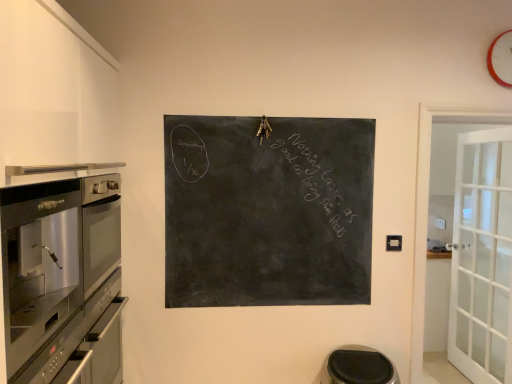
Question: Is black rubber step stool at lower center positioned beyond the bounds of black chalkboard at center?

Choices:
 (A) yes
 (B) no

Answer: (A)

Question: Is black rubber step stool at lower center next to black chalkboard at center?

Choices:
 (A) yes
 (B) no

Answer: (B)

Question: Would you say black chalkboard at center is part of black rubber step stool at lower center's contents?

Choices:
 (A) yes
 (B) no

Answer: (B)

Question: Considering the relative sizes of black rubber step stool at lower center and black chalkboard at center in the image provided, is black rubber step stool at lower center thinner than black chalkboard at center?

Choices:
 (A) yes
 (B) no

Answer: (B)

Question: Is the position of black rubber step stool at lower center less distant than that of black chalkboard at center?

Choices:
 (A) no
 (B) yes

Answer: (B)

Question: Is stainless steel oven at left to the left or to the right of black rubber step stool at lower center in the image?

Choices:
 (A) right
 (B) left

Answer: (B)

Question: Relative to black rubber step stool at lower center, is stainless steel oven at left in front or behind?

Choices:
 (A) front
 (B) behind

Answer: (A)

Question: Is stainless steel oven at left taller or shorter than black rubber step stool at lower center?

Choices:
 (A) short
 (B) tall

Answer: (B)

Question: Is point (80, 208) closer or farther from the camera than point (352, 352)?

Choices:
 (A) closer
 (B) farther

Answer: (A)

Question: Considering the relative positions of orange plastic clock at upper right and black rubber step stool at lower center in the image provided, is orange plastic clock at upper right to the left or to the right of black rubber step stool at lower center?

Choices:
 (A) right
 (B) left

Answer: (A)

Question: From the image's perspective, is orange plastic clock at upper right positioned above or below black rubber step stool at lower center?

Choices:
 (A) below
 (B) above

Answer: (B)

Question: Looking at the image, does orange plastic clock at upper right seem bigger or smaller compared to black rubber step stool at lower center?

Choices:
 (A) small
 (B) big

Answer: (A)

Question: Is point (507, 79) positioned closer to the camera than point (366, 374)?

Choices:
 (A) farther
 (B) closer

Answer: (A)

Question: Is black chalkboard at center situated inside stainless steel oven at left or outside?

Choices:
 (A) inside
 (B) outside

Answer: (B)

Question: Relative to stainless steel oven at left, is black chalkboard at center in front or behind?

Choices:
 (A) behind
 (B) front

Answer: (A)